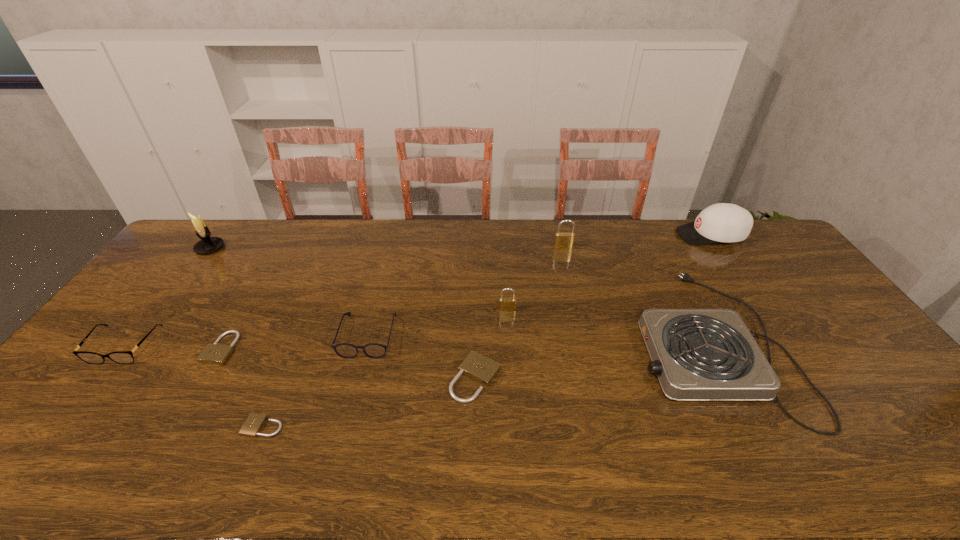
Locate an element on the screen. free space between the second shortest object and the hotplate is located at coordinates (466, 346).

Where is `the closest object to the tallest object`? The image size is (960, 540). the closest object to the tallest object is located at coordinates (121, 357).

Point out which object is positioned as the fourth nearest to the white candle holder. Please provide its 2D coordinates. Your answer should be formatted as a tuple, i.e. [(x, y)], where the tuple contains the x and y coordinates of a point satisfying the conditions above.

[(252, 426)]

Select which padlock appears as the fifth closest to the baseball cap. Please provide its 2D coordinates. Your answer should be formatted as a tuple, i.e. [(x, y)], where the tuple contains the x and y coordinates of a point satisfying the conditions above.

[(217, 354)]

Identify which padlock is located as the fourth nearest to the left spectacles. Please provide its 2D coordinates. Your answer should be formatted as a tuple, i.e. [(x, y)], where the tuple contains the x and y coordinates of a point satisfying the conditions above.

[(505, 304)]

Point out which beige padlock is positioned as the third nearest to the fourth object from right to left. Please provide its 2D coordinates. Your answer should be formatted as a tuple, i.e. [(x, y)], where the tuple contains the x and y coordinates of a point satisfying the conditions above.

[(217, 354)]

Select which beige padlock appears as the closest to the left spectacles. Please provide its 2D coordinates. Your answer should be formatted as a tuple, i.e. [(x, y)], where the tuple contains the x and y coordinates of a point satisfying the conditions above.

[(217, 354)]

Image resolution: width=960 pixels, height=540 pixels. In order to click on vacant region that satisfies the following two spatial constraints: 1. on the front-facing side of the biggest beige padlock; 2. on the left side of the sixth object from right to left in this screenshot , I will do `click(357, 378)`.

Where is `vacant space that satisfies the following two spatial constraints: 1. on the front-facing side of the left spectacles; 2. on the right side of the fourth padlock from right to left`? vacant space that satisfies the following two spatial constraints: 1. on the front-facing side of the left spectacles; 2. on the right side of the fourth padlock from right to left is located at coordinates (63, 426).